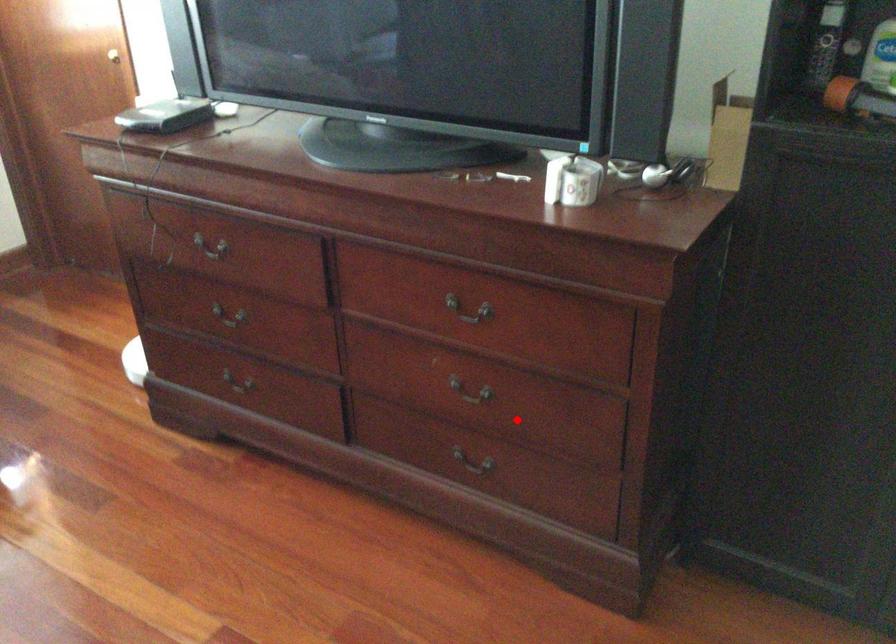
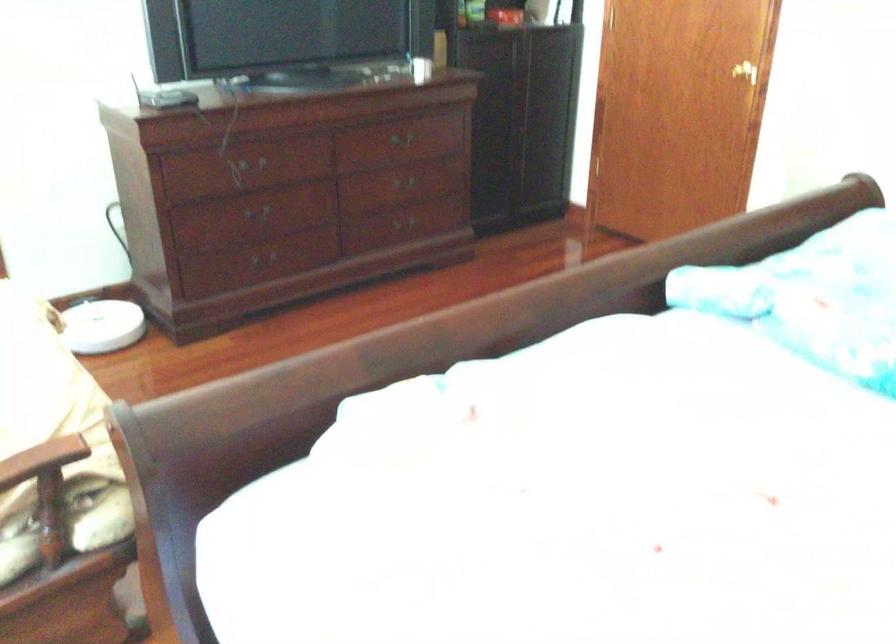
Question: I am providing you with two images of the same scene from different viewpoints. A red point is shown in image1. For the corresponding object point in image2, is it positioned nearer or farther from the camera?

Choices:
 (A) Nearer
 (B) Farther

Answer: (B)